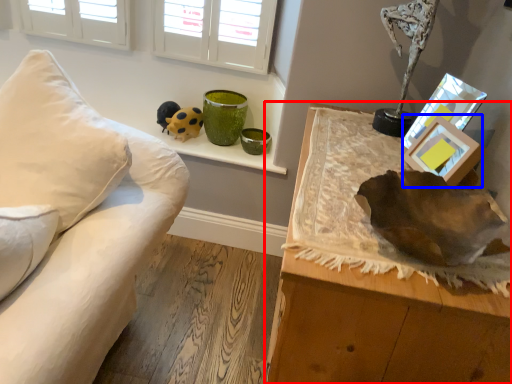
Question: Which object appears farthest to the camera in this image, table (highlighted by a red box) or picture frame (highlighted by a blue box)?

Choices:
 (A) table
 (B) picture frame

Answer: (B)